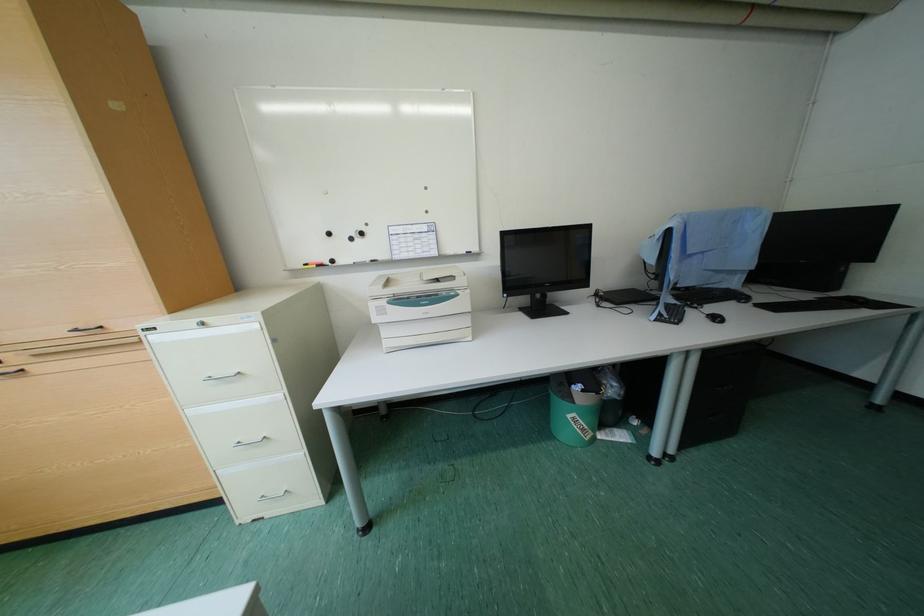
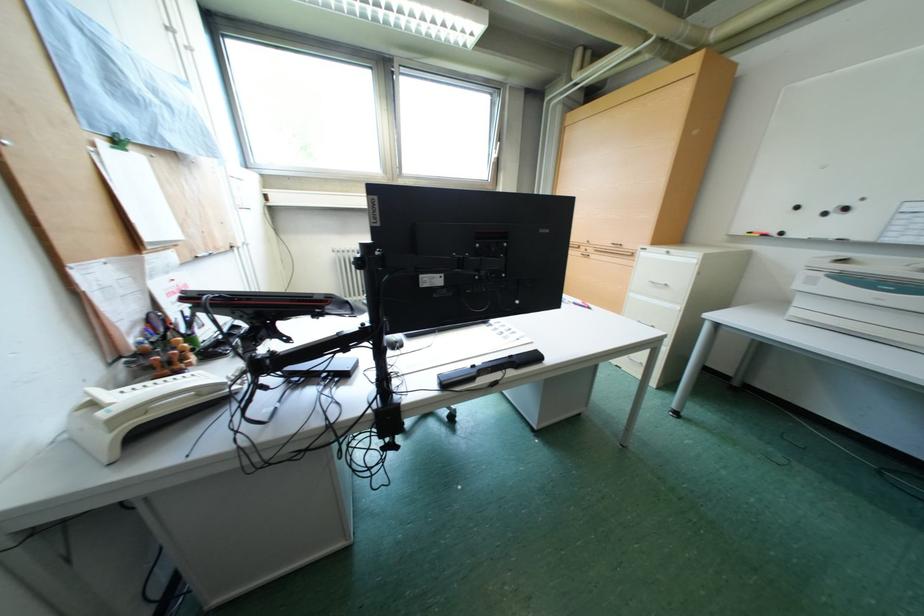
Based on the photo, how did the camera likely rotate?

The rotation direction of the camera is left-down.